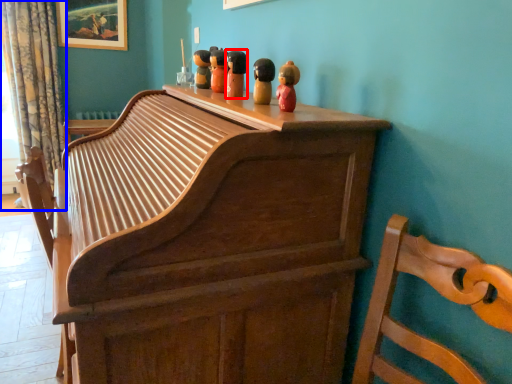
Question: Among these objects, which one is farthest to the camera, toy (highlighted by a red box) or curtain (highlighted by a blue box)?

Choices:
 (A) toy
 (B) curtain

Answer: (B)